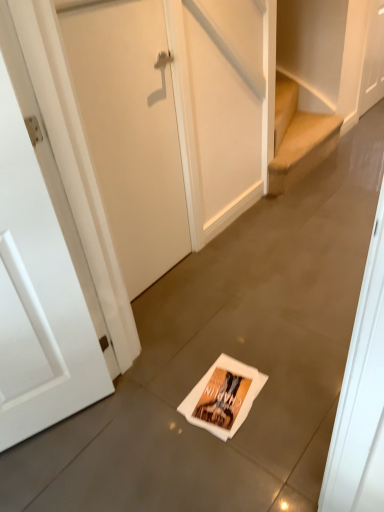
Question: Is point (147, 152) closer or farther from the camera than point (195, 413)?

Choices:
 (A) farther
 (B) closer

Answer: (A)

Question: From the image's perspective, is white matte door at center, the second door in the front-to-back sequence, positioned above or below white paper flyer at center?

Choices:
 (A) below
 (B) above

Answer: (B)

Question: Estimate the real-world distances between objects in this image. Which object is farther from the white matte door at upper right, which appears as the first door when viewed from the right?

Choices:
 (A) white matte door at center, the second door in the front-to-back sequence
 (B) white matte door at left, the 3th door in the top-to-bottom sequence
 (C) white paper flyer at center

Answer: (B)

Question: Considering the real-world distances, which object is closest to the white matte door at left, which is counted as the 1th door, starting from the bottom?

Choices:
 (A) white matte door at upper right, the first door viewed from the top
 (B) white matte door at center, positioned as the second door in bottom-to-top order
 (C) white paper flyer at center

Answer: (C)